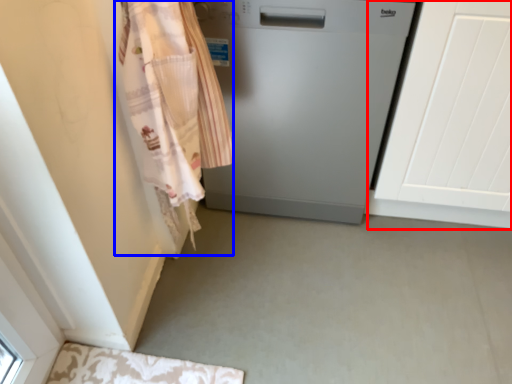
Question: Among these objects, which one is nearest to the camera, screen door (highlighted by a red box) or clothing (highlighted by a blue box)?

Choices:
 (A) screen door
 (B) clothing

Answer: (B)